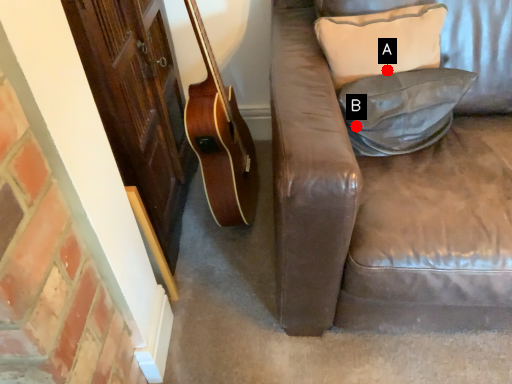
Question: Two points are circled on the image, labeled by A and B beside each circle. Which point appears farthest from the camera in this image?

Choices:
 (A) A is further
 (B) B is further

Answer: (A)